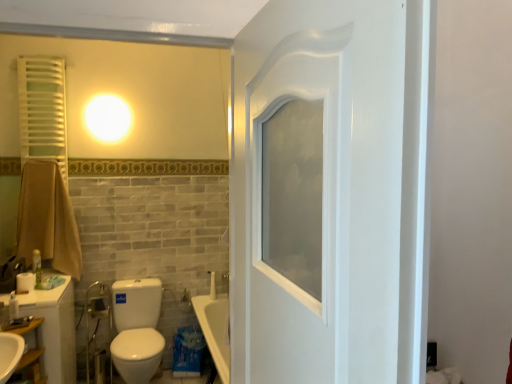
Question: Can you confirm if white glossy toilet at lower left is bigger than brown cotton towel at left?

Choices:
 (A) yes
 (B) no

Answer: (A)

Question: Would you say brown cotton towel at left is part of white glossy toilet at lower left's contents?

Choices:
 (A) yes
 (B) no

Answer: (B)

Question: Does white glossy toilet at lower left have a lesser height compared to brown cotton towel at left?

Choices:
 (A) yes
 (B) no

Answer: (A)

Question: Considering the relative sizes of white glossy toilet at lower left and brown cotton towel at left in the image provided, is white glossy toilet at lower left wider than brown cotton towel at left?

Choices:
 (A) no
 (B) yes

Answer: (B)

Question: Is white glossy toilet at lower left to the left of brown cotton towel at left from the viewer's perspective?

Choices:
 (A) yes
 (B) no

Answer: (B)

Question: Could you tell me if white glossy toilet at lower left is facing brown cotton towel at left?

Choices:
 (A) yes
 (B) no

Answer: (B)

Question: Is white matte toilet paper at lower left at the right side of wooden shelf at lower left?

Choices:
 (A) yes
 (B) no

Answer: (B)

Question: Can you confirm if white matte toilet paper at lower left is taller than wooden shelf at lower left?

Choices:
 (A) no
 (B) yes

Answer: (A)

Question: Is wooden shelf at lower left a part of white matte toilet paper at lower left?

Choices:
 (A) yes
 (B) no

Answer: (B)

Question: Is white matte toilet paper at lower left further to camera compared to wooden shelf at lower left?

Choices:
 (A) yes
 (B) no

Answer: (A)

Question: Is white matte toilet paper at lower left outside wooden shelf at lower left?

Choices:
 (A) yes
 (B) no

Answer: (A)

Question: Is the position of white matte toilet paper at lower left less distant than that of wooden shelf at lower left?

Choices:
 (A) yes
 (B) no

Answer: (B)

Question: Can you confirm if white glossy toilet at lower left is positioned to the right of white matte toilet paper at lower left?

Choices:
 (A) yes
 (B) no

Answer: (A)